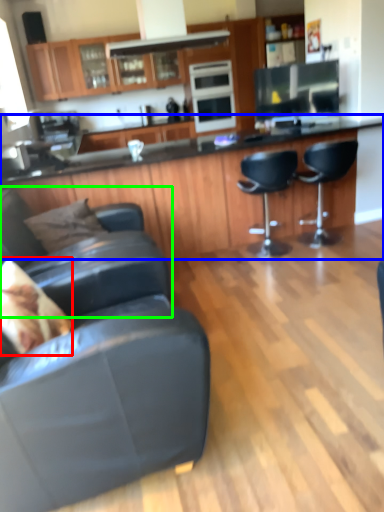
Question: Which object is the farthest from pillow (highlighted by a red box)? Choose among these: countertop (highlighted by a blue box) or chair (highlighted by a green box).

Choices:
 (A) countertop
 (B) chair

Answer: (A)